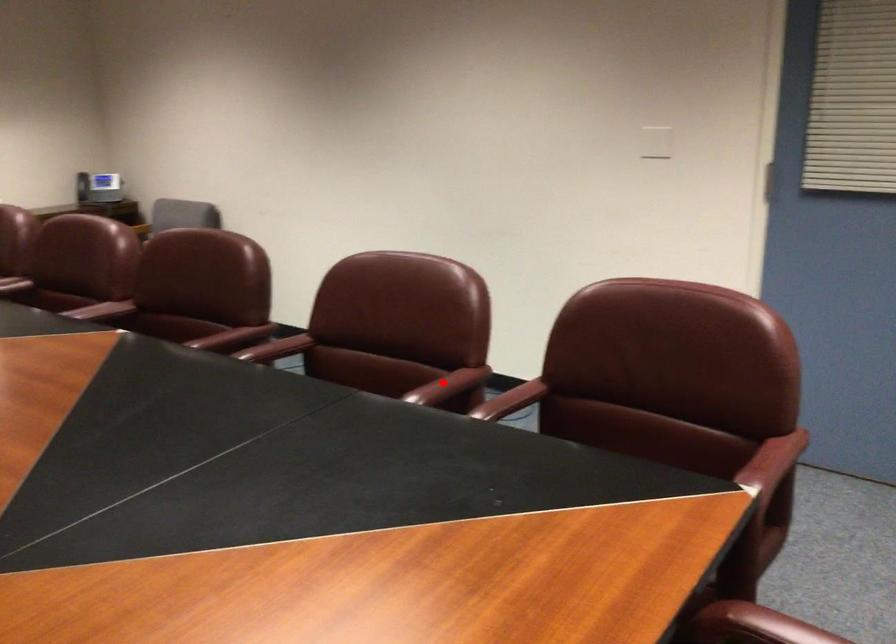
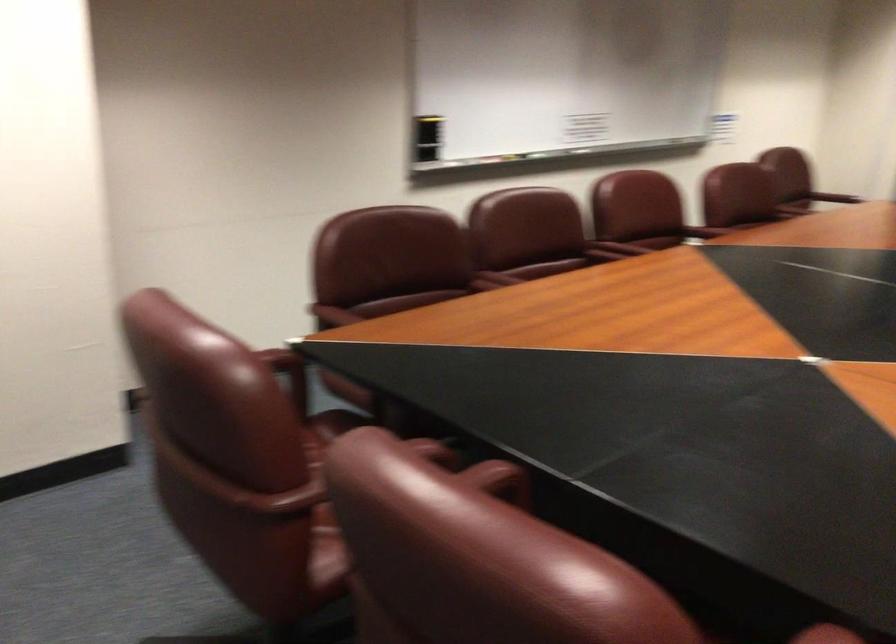
Question: A red point is marked in image1. In image2, is the corresponding 3D point closer to the camera or farther? Reply with the corresponding letter.

Choices:
 (A) The corresponding 3D point is closer.
 (B) The corresponding 3D point is farther.

Answer: (A)